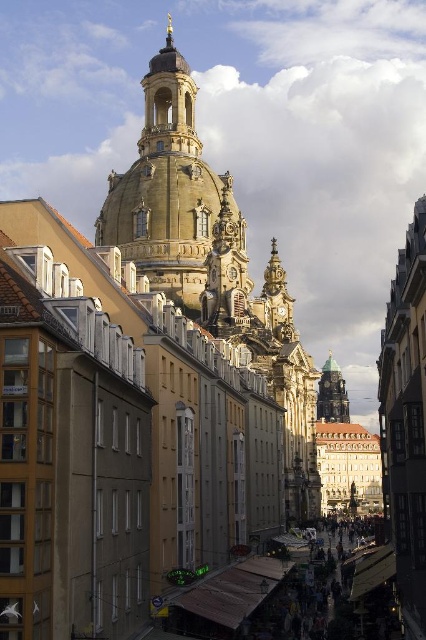
Is golden stone tower at upper center behind gold textured dome at center?

No, it is in front of gold textured dome at center.

Can you confirm if golden stone tower at upper center is wider than gold textured dome at center?

Yes.

Which is behind, point (213, 184) or point (337, 372)?

Point (337, 372)

You are a GUI agent. You are given a task and a screenshot of the screen. Output one action in this format:
    pyautogui.click(x=<x>, y=<y>)
    Task: Click on the golden stone tower at upper center
    This screenshot has width=426, height=640.
    Given the screenshot: What is the action you would take?
    pyautogui.click(x=166, y=188)